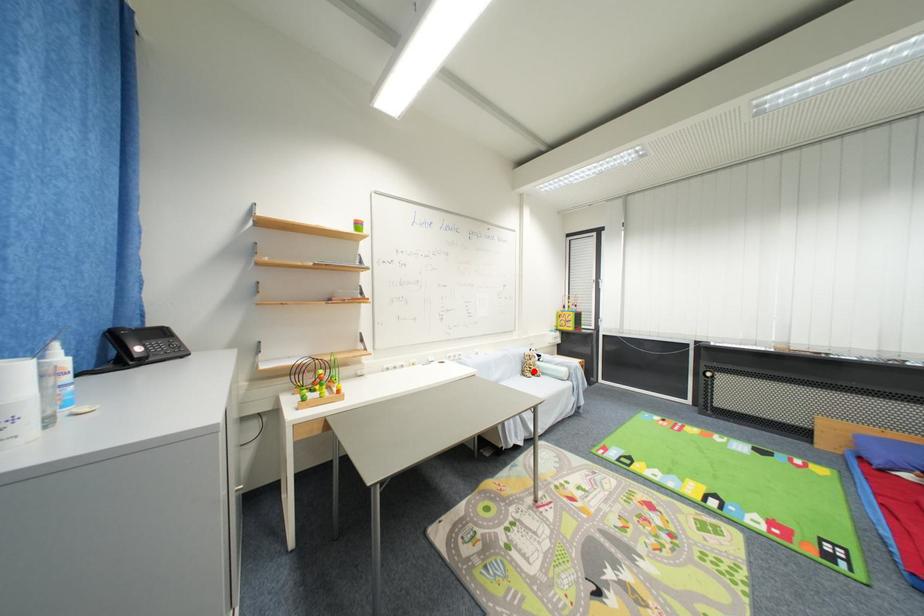
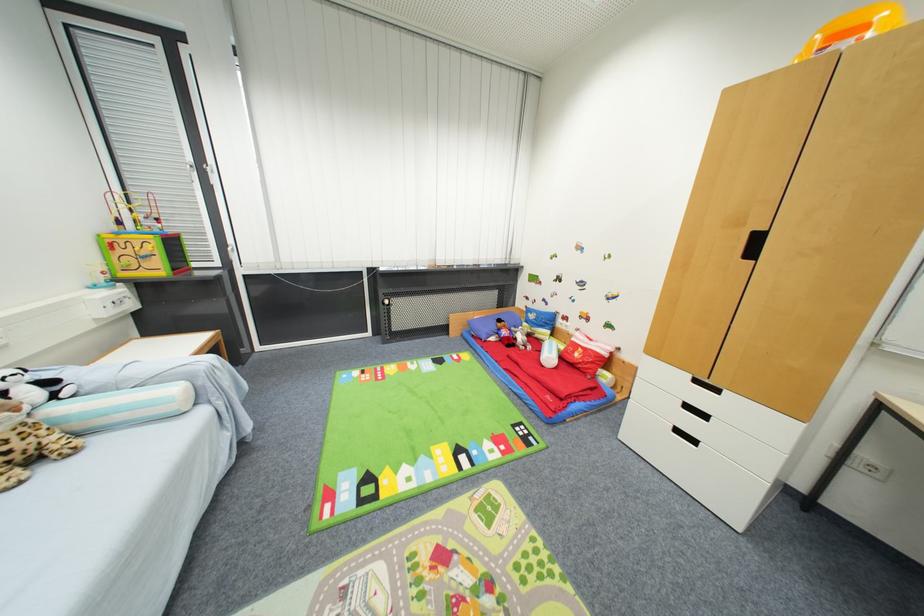
In the second image, find the point that corresponds to the highlighted location in the first image.

(7, 456)